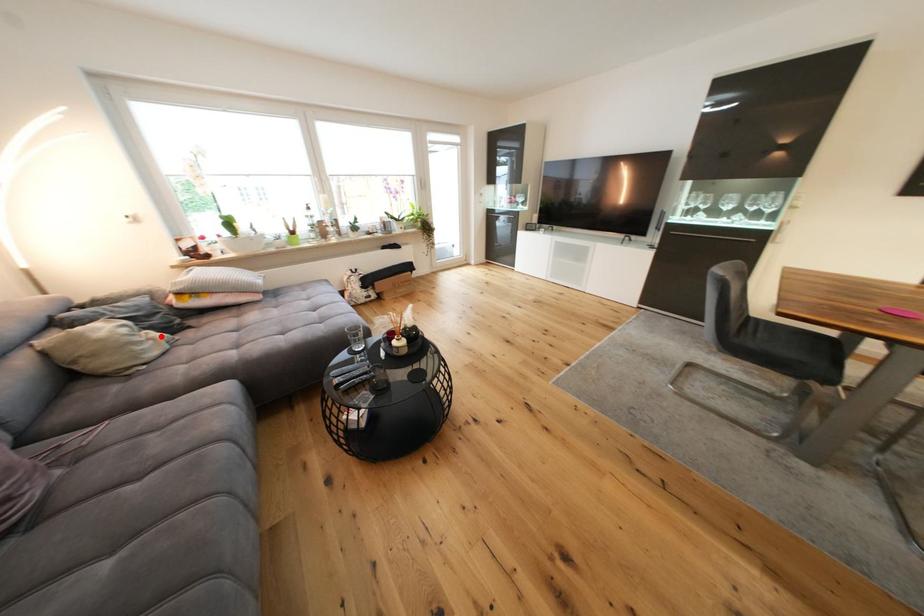
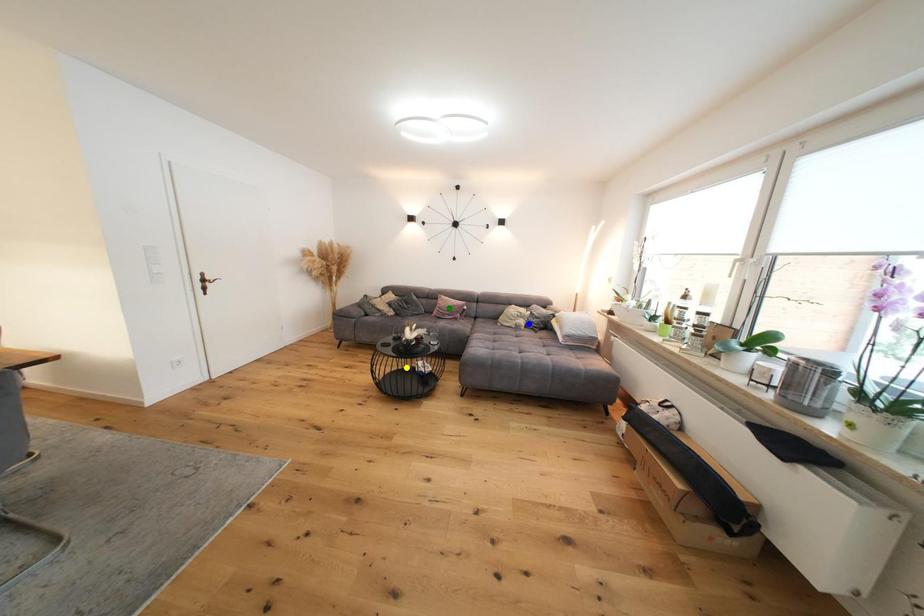
Question: I am providing you with two images of the same scene from different viewpoints. A red point is marked on the first image. You are given multiple points on the second image. Which point in image 2 is actually the same real-world point as the red point in image 1?

Choices:
 (A) blue point
 (B) yellow point
 (C) green point

Answer: (A)